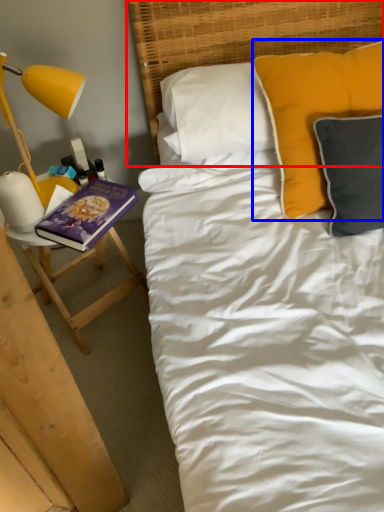
Question: Which object is further to the camera taking this photo, headboard (highlighted by a red box) or pillow (highlighted by a blue box)?

Choices:
 (A) headboard
 (B) pillow

Answer: (A)